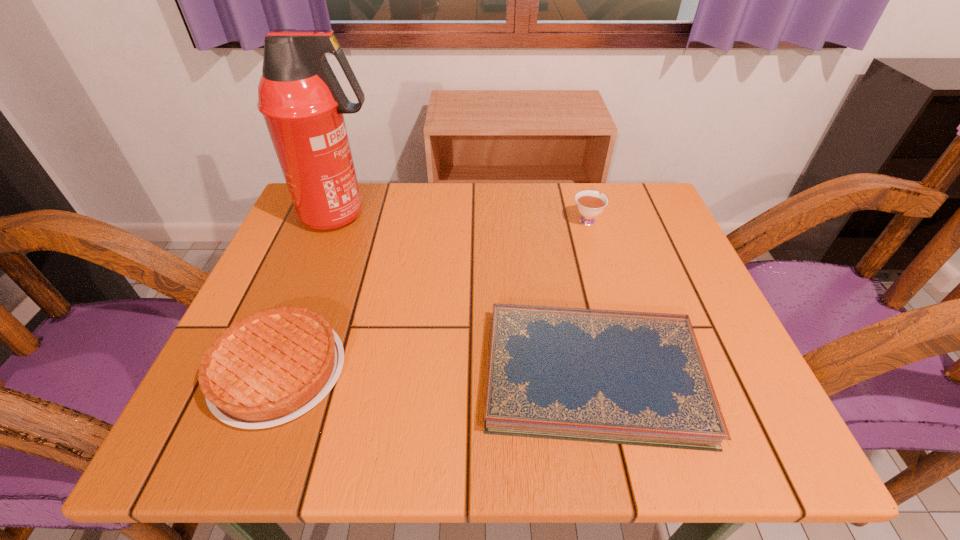
Find the location of `fire extinguisher that is at the far edge`. fire extinguisher that is at the far edge is located at coordinates (302, 102).

You are a GUI agent. You are given a task and a screenshot of the screen. Output one action in this format:
    pyautogui.click(x=<x>, y=<y>)
    Task: Click on the teacup situated at the far edge
    This screenshot has width=960, height=540.
    Given the screenshot: What is the action you would take?
    pyautogui.click(x=589, y=203)

Locate an element on the screen. Image resolution: width=960 pixels, height=540 pixels. pie at the near edge is located at coordinates (270, 367).

You are a GUI agent. You are given a task and a screenshot of the screen. Output one action in this format:
    pyautogui.click(x=<x>, y=<y>)
    Task: Click on the paperback book present at the near edge
    
    Given the screenshot: What is the action you would take?
    pyautogui.click(x=639, y=378)

Find the location of a particular element. fire extinguisher that is at the left edge is located at coordinates (302, 102).

Identify the location of pie present at the left edge. [270, 367].

In order to click on teacup present at the right edge in this screenshot , I will do `click(589, 203)`.

What are the coordinates of `paperback book that is positioned at the right edge` in the screenshot? It's located at (639, 378).

Where is `object that is at the far left corner`? object that is at the far left corner is located at coordinates (302, 102).

Identify the location of object that is at the near left corner. This screenshot has width=960, height=540. (270, 367).